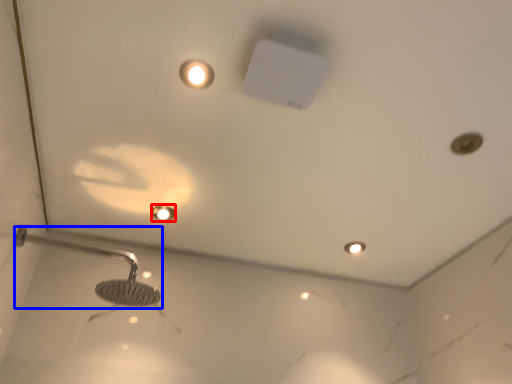
Question: Which object appears farthest to the camera in this image, droplight (highlighted by a red box) or shower (highlighted by a blue box)?

Choices:
 (A) droplight
 (B) shower

Answer: (A)